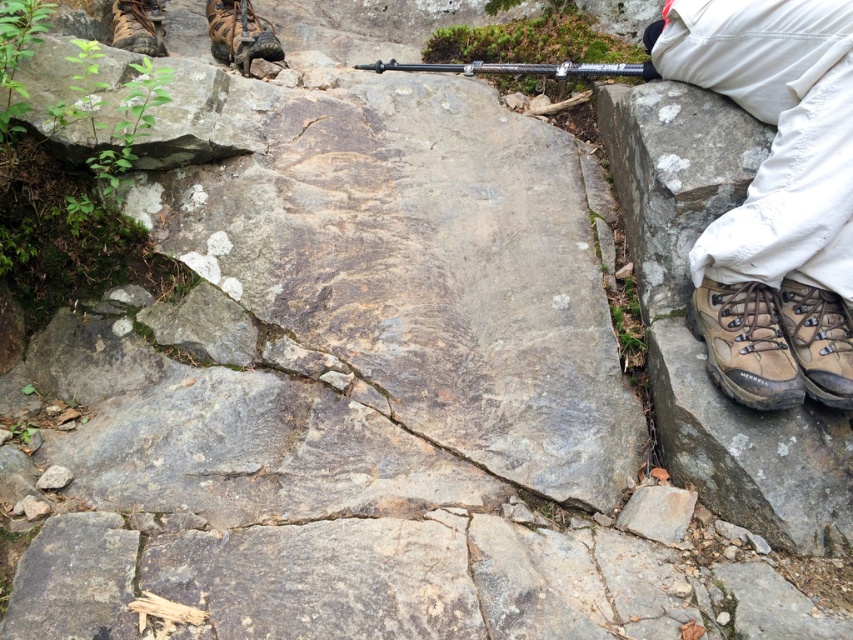
Question: Which of the following is the closest to the observer?

Choices:
 (A) (260, 29)
 (B) (772, 339)
 (C) (155, 16)

Answer: (B)

Question: Can you confirm if brown leather boots at lower right is positioned below brown leather boot at lower right?

Choices:
 (A) yes
 (B) no

Answer: (B)

Question: In this image, where is brown leather boot at lower right located relative to silver metallic gun at upper center?

Choices:
 (A) left
 (B) right

Answer: (B)

Question: Considering the real-world distances, which object is closest to the brown leather boot at lower right?

Choices:
 (A) brown leather shoe at upper left
 (B) brown leather boots at lower right

Answer: (B)

Question: Which point is closer to the camera taking this photo?

Choices:
 (A) (775, 344)
 (B) (637, 74)
 (C) (811, 348)

Answer: (A)

Question: Where is brown leather boots at lower right located in relation to brown leather shoe at upper left in the image?

Choices:
 (A) left
 (B) right

Answer: (B)